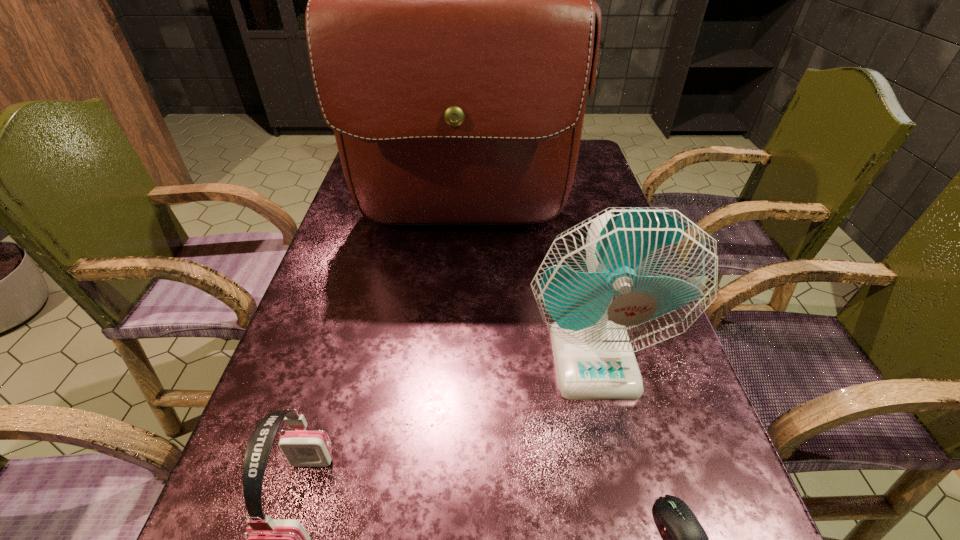
In the image, there is a desktop. Identify the location of vacant space at the right edge. The width and height of the screenshot is (960, 540). (573, 208).

The height and width of the screenshot is (540, 960). I want to click on free space between the farthest object and the fan, so click(527, 291).

This screenshot has height=540, width=960. Find the location of `vacant area that lies between the satchel and the third shortest object`. vacant area that lies between the satchel and the third shortest object is located at coordinates (527, 291).

This screenshot has width=960, height=540. What are the coordinates of `object that is the third closest one to the third nearest object` in the screenshot? It's located at (269, 539).

At what (x,y) coordinates should I click in order to perform the action: click on object that is the third closest to the shortest object. Please return your answer as a coordinate pair (x, y). The height and width of the screenshot is (540, 960). Looking at the image, I should click on (452, 35).